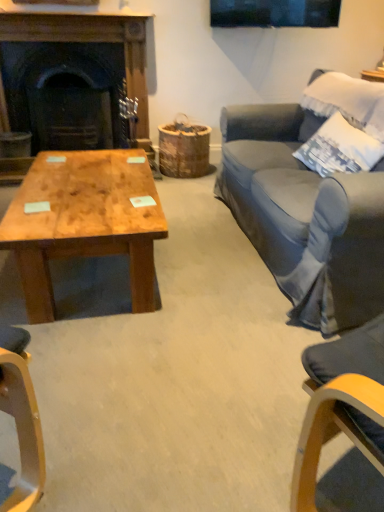
Question: From a real-world perspective, does dark wood fireplace at left stand above white cotton pillow at upper right?

Choices:
 (A) no
 (B) yes

Answer: (A)

Question: Is dark wood fireplace at left taller than white cotton pillow at upper right?

Choices:
 (A) yes
 (B) no

Answer: (A)

Question: Is dark wood fireplace at left at the right side of white cotton pillow at upper right?

Choices:
 (A) no
 (B) yes

Answer: (A)

Question: Is dark wood fireplace at left looking in the opposite direction of white cotton pillow at upper right?

Choices:
 (A) no
 (B) yes

Answer: (A)

Question: From the image's perspective, is dark wood fireplace at left under white cotton pillow at upper right?

Choices:
 (A) yes
 (B) no

Answer: (B)

Question: Based on their sizes in the image, would you say natural wood coffee table at lower left is bigger or smaller than white cotton pillow at upper right?

Choices:
 (A) small
 (B) big

Answer: (B)

Question: Which is correct: natural wood coffee table at lower left is inside white cotton pillow at upper right, or outside of it?

Choices:
 (A) inside
 (B) outside

Answer: (B)

Question: Considering the positions of point (54, 249) and point (354, 133), is point (54, 249) closer or farther from the camera than point (354, 133)?

Choices:
 (A) closer
 (B) farther

Answer: (A)

Question: In terms of height, does natural wood coffee table at lower left look taller or shorter compared to white cotton pillow at upper right?

Choices:
 (A) tall
 (B) short

Answer: (B)

Question: Is natural wood coffee table at lower left inside or outside of dark wood fireplace at left?

Choices:
 (A) inside
 (B) outside

Answer: (B)

Question: Considering the positions of natural wood coffee table at lower left and dark wood fireplace at left in the image, is natural wood coffee table at lower left bigger or smaller than dark wood fireplace at left?

Choices:
 (A) small
 (B) big

Answer: (A)

Question: From a real-world perspective, is natural wood coffee table at lower left physically located above or below dark wood fireplace at left?

Choices:
 (A) below
 (B) above

Answer: (A)

Question: Visually, is natural wood coffee table at lower left positioned to the left or to the right of dark wood fireplace at left?

Choices:
 (A) left
 (B) right

Answer: (B)

Question: In terms of width, does white cotton pillow at upper right look wider or thinner when compared to natural wood coffee table at lower left?

Choices:
 (A) thin
 (B) wide

Answer: (A)

Question: From their relative heights in the image, would you say white cotton pillow at upper right is taller or shorter than natural wood coffee table at lower left?

Choices:
 (A) short
 (B) tall

Answer: (B)